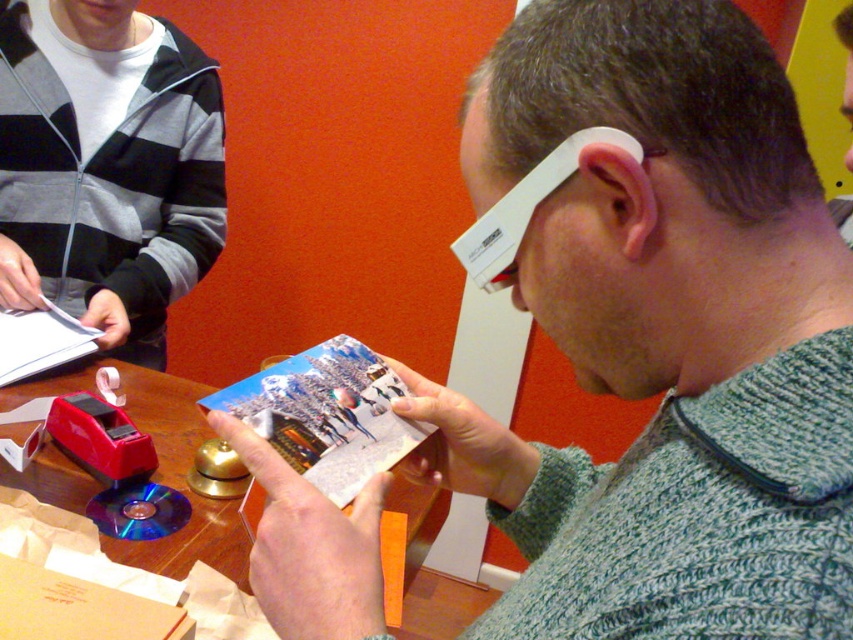
Who is higher up, striped cotton hoodie at upper left or printed paper magazine at center?

striped cotton hoodie at upper left

Can you confirm if striped cotton hoodie at upper left is wider than printed paper magazine at center?

Yes.

Identify the location of striped cotton hoodie at upper left. (107, 166).

Does green knitted sweater at center appear on the right side of printed paper magazine at center?

Correct, you'll find green knitted sweater at center to the right of printed paper magazine at center.

Can you confirm if green knitted sweater at center is bigger than printed paper magazine at center?

Yes.

Is point (555, 502) closer to camera compared to point (335, 468)?

No, (555, 502) is further to viewer.

Locate an element on the screen. Image resolution: width=853 pixels, height=640 pixels. green knitted sweater at center is located at coordinates (657, 330).

Between striped cotton hoodie at upper left and matte paper magazine at center, which one appears on the right side from the viewer's perspective?

Positioned to the right is striped cotton hoodie at upper left.

Who is more forward, (120, 324) or (38, 365)?

Positioned in front is point (38, 365).

This screenshot has width=853, height=640. Identify the location of striped cotton hoodie at upper left. (107, 166).